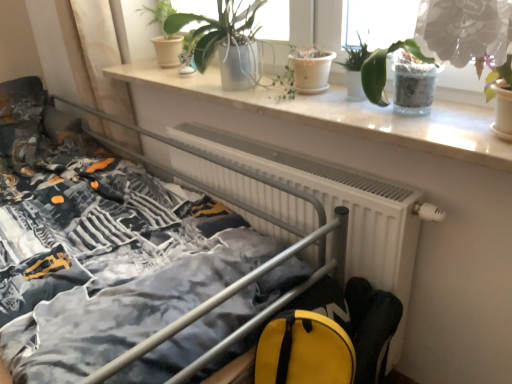
Question: Should I look upward or downward to see white marble window sill at upper center?

Choices:
 (A) down
 (B) up

Answer: (B)

Question: Considering the relative positions of matte white pot at upper center, acting as the fourth houseplant starting from the right, and translucent glass pot at upper right, arranged as the fourth houseplant when viewed from the left, in the image provided, is matte white pot at upper center, acting as the fourth houseplant starting from the right, to the left of translucent glass pot at upper right, arranged as the fourth houseplant when viewed from the left, from the viewer's perspective?

Choices:
 (A) no
 (B) yes

Answer: (B)

Question: Does matte white pot at upper center, marked as the 2th houseplant in a left-to-right arrangement, contain translucent glass pot at upper right, arranged as the second houseplant when viewed from the right?

Choices:
 (A) yes
 (B) no

Answer: (B)

Question: Could you tell me if matte white pot at upper center, marked as the 2th houseplant in a left-to-right arrangement, is turned towards translucent glass pot at upper right, arranged as the fourth houseplant when viewed from the left?

Choices:
 (A) yes
 (B) no

Answer: (B)

Question: From the image's perspective, would you say matte white pot at upper center, acting as the fourth houseplant starting from the right, is positioned over translucent glass pot at upper right, arranged as the second houseplant when viewed from the right?

Choices:
 (A) yes
 (B) no

Answer: (A)

Question: Can we say matte white pot at upper center, marked as the 2th houseplant in a left-to-right arrangement, lies outside translucent glass pot at upper right, arranged as the fourth houseplant when viewed from the left?

Choices:
 (A) no
 (B) yes

Answer: (B)

Question: Does matte white pot at upper center, marked as the 2th houseplant in a left-to-right arrangement, appear on the right side of translucent glass pot at upper right, arranged as the second houseplant when viewed from the right?

Choices:
 (A) no
 (B) yes

Answer: (A)

Question: From a real-world perspective, is matte white pot at upper center, marked as the 2th houseplant in a left-to-right arrangement, below green glossy plant at upper right, which appears as the first houseplant when viewed from the right?

Choices:
 (A) yes
 (B) no

Answer: (B)

Question: Is matte white pot at upper center, marked as the 2th houseplant in a left-to-right arrangement, further to the viewer compared to green glossy plant at upper right, which appears as the fifth houseplant when viewed from the left?

Choices:
 (A) no
 (B) yes

Answer: (B)

Question: Is green glossy plant at upper right, which appears as the fifth houseplant when viewed from the left, located within matte white pot at upper center, acting as the fourth houseplant starting from the right?

Choices:
 (A) yes
 (B) no

Answer: (B)

Question: Does matte white pot at upper center, marked as the 2th houseplant in a left-to-right arrangement, have a larger size compared to green glossy plant at upper right, which appears as the fifth houseplant when viewed from the left?

Choices:
 (A) no
 (B) yes

Answer: (B)

Question: Is matte white pot at upper center, acting as the fourth houseplant starting from the right, at the left side of green glossy plant at upper right, which appears as the fifth houseplant when viewed from the left?

Choices:
 (A) yes
 (B) no

Answer: (A)

Question: Can you confirm if matte white pot at upper center, marked as the 2th houseplant in a left-to-right arrangement, is positioned to the right of green glossy plant at upper right, which appears as the first houseplant when viewed from the right?

Choices:
 (A) yes
 (B) no

Answer: (B)

Question: Are metallic gray bed at center and green glossy plant at upper right, which appears as the fifth houseplant when viewed from the left, located far from each other?

Choices:
 (A) yes
 (B) no

Answer: (A)